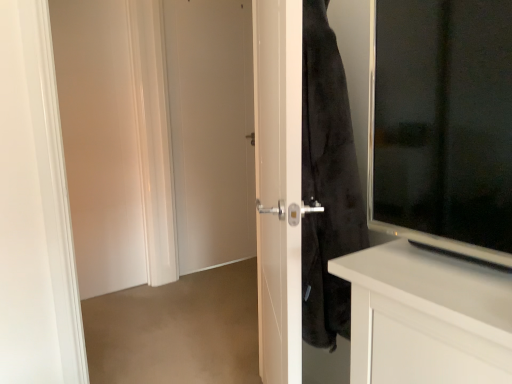
Question: Does white matte door at left, which ranks as the first screen door in left-to-right order, appear on the right side of white glossy door at center, which ranks as the 2th screen door in left-to-right order?

Choices:
 (A) no
 (B) yes

Answer: (A)

Question: Is white glossy door at center, arranged as the first screen door when viewed from the right, at the back of white matte door at left, which ranks as the first screen door in left-to-right order?

Choices:
 (A) no
 (B) yes

Answer: (A)

Question: Can you confirm if white matte door at left, the 2th screen door positioned from the right, is taller than white glossy door at center, which is the second screen door from back to front?

Choices:
 (A) no
 (B) yes

Answer: (B)

Question: From the image's perspective, is white matte door at left, the first screen door in the back-to-front sequence, beneath white glossy door at center, arranged as the first screen door when viewed from the right?

Choices:
 (A) yes
 (B) no

Answer: (B)

Question: Is white matte door at left, the 2th screen door when ordered from front to back, positioned far away from white glossy door at center, arranged as the first screen door when viewed from the right?

Choices:
 (A) no
 (B) yes

Answer: (A)

Question: Considering the relative sizes of white matte door at left, the first screen door in the back-to-front sequence, and white glossy door at center, arranged as the first screen door when viewed from the right, in the image provided, is white matte door at left, the first screen door in the back-to-front sequence, wider than white glossy door at center, arranged as the first screen door when viewed from the right,?

Choices:
 (A) no
 (B) yes

Answer: (A)

Question: Considering the relative sizes of white glossy door at center, positioned as the first screen door in front-to-back order, and white matte door at left, the 2th screen door when ordered from front to back, in the image provided, is white glossy door at center, positioned as the first screen door in front-to-back order, wider than white matte door at left, the 2th screen door when ordered from front to back,?

Choices:
 (A) yes
 (B) no

Answer: (A)

Question: Is white glossy door at center, which is the second screen door from back to front, oriented towards white matte door at left, the first screen door in the back-to-front sequence?

Choices:
 (A) yes
 (B) no

Answer: (B)

Question: From a real-world perspective, is white glossy door at center, positioned as the first screen door in front-to-back order, below white matte door at left, the 2th screen door positioned from the right?

Choices:
 (A) no
 (B) yes

Answer: (B)

Question: Is white glossy door at center, arranged as the first screen door when viewed from the right, outside of white matte door at left, the 2th screen door positioned from the right?

Choices:
 (A) no
 (B) yes

Answer: (B)

Question: From the image's perspective, does white glossy door at center, which ranks as the 2th screen door in left-to-right order, appear higher than white matte door at left, which ranks as the first screen door in left-to-right order?

Choices:
 (A) no
 (B) yes

Answer: (A)

Question: Is white glossy door at center, which ranks as the 2th screen door in left-to-right order, far away from white matte door at left, the first screen door in the back-to-front sequence?

Choices:
 (A) yes
 (B) no

Answer: (B)

Question: Is white matte door at left, the first screen door in the back-to-front sequence, positioned behind white matte door at center?

Choices:
 (A) no
 (B) yes

Answer: (A)